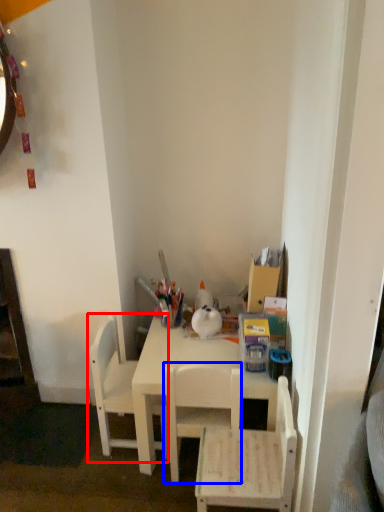
Question: Which object appears closest to the camera in this image, chair (highlighted by a red box) or chair (highlighted by a blue box)?

Choices:
 (A) chair
 (B) chair

Answer: (B)